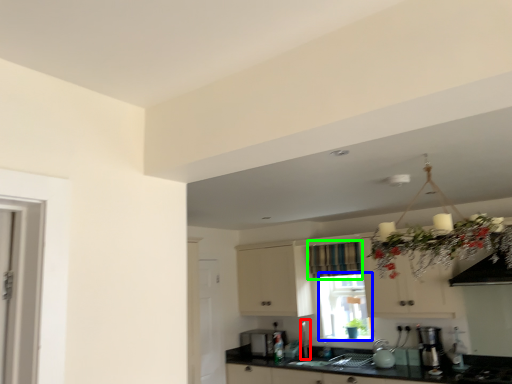
Question: Considering the real-world distances, which object is farthest from faucet (highlighted by a red box)? window screen (highlighted by a blue box) or curtain (highlighted by a green box)?

Choices:
 (A) window screen
 (B) curtain

Answer: (B)